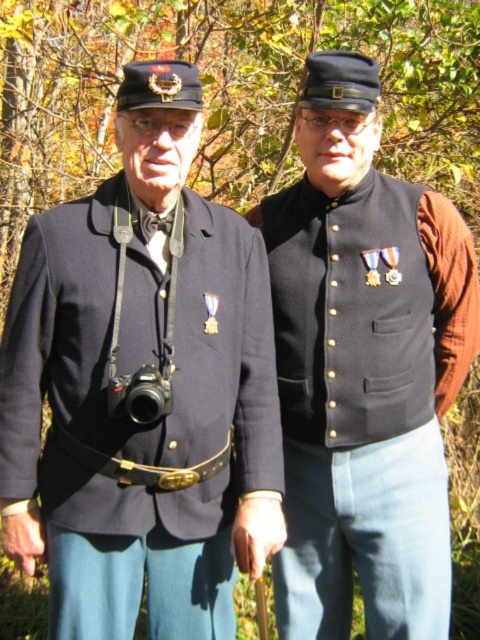
Question: Is matte black jacket at center smaller than black plastic camera at left?

Choices:
 (A) yes
 (B) no

Answer: (B)

Question: Which of these objects is positioned closest to the black plastic camera at left?

Choices:
 (A) matte black vest at center
 (B) matte black jacket at center

Answer: (B)

Question: Does matte black vest at center appear on the right side of black plastic camera at left?

Choices:
 (A) no
 (B) yes

Answer: (B)

Question: Which point is closer to the camera?

Choices:
 (A) (156, 404)
 (B) (331, 353)
 (C) (151, 429)

Answer: (A)

Question: Estimate the real-world distances between objects in this image. Which object is closer to the black plastic camera at left?

Choices:
 (A) matte black jacket at center
 (B) matte black vest at center

Answer: (A)

Question: Can you confirm if matte black vest at center is positioned to the right of black plastic camera at left?

Choices:
 (A) yes
 (B) no

Answer: (A)